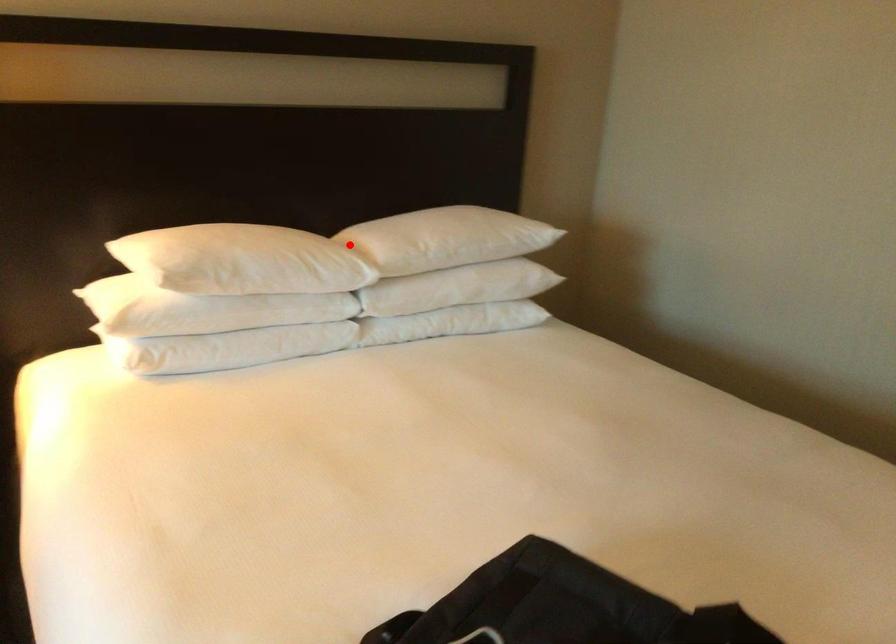
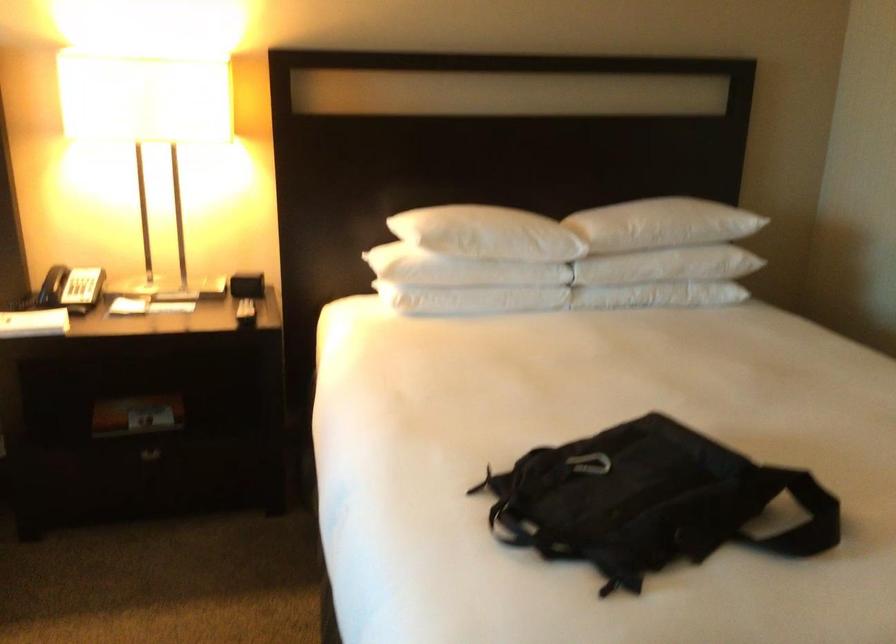
In the second image, find the point that corresponds to the highlighted location in the first image.

(571, 223)